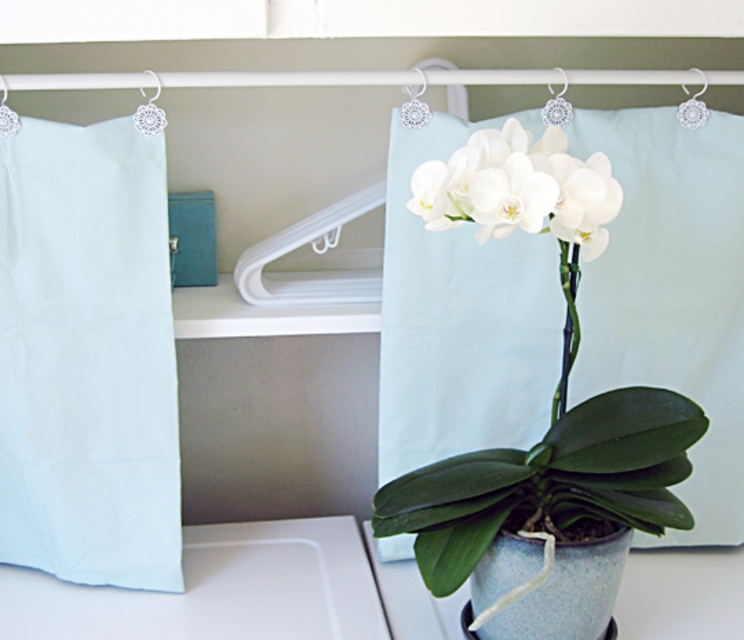
You are organizing a small event and need to place a decorative pillow on the shelf. The shelf has limited space. Given the light blue fabric at left and the white matte pillow at center, which object can you place without exceeding the shelf space?

The light blue fabric at left has a smaller size compared to the white matte pillow at center, so placing the light blue fabric at left would be more feasible without exceeding the shelf space.

You are standing in front of the shelf in the image and want to place a new item exactly at the coordinates given for the light blue fabric at left. What is the exact coordinate where you should place it?

The light blue fabric at left is positioned at point (x=86, y=356), so you should place the new item at those coordinates.